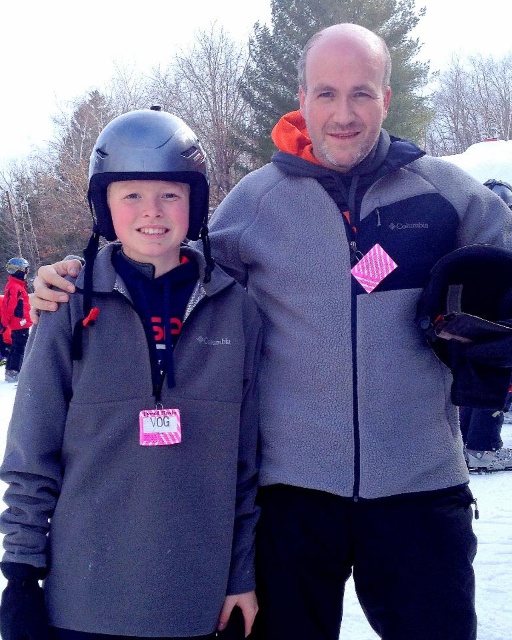
Between point (118, 630) and point (209, 259), which one is positioned behind?

Positioned behind is point (209, 259).

Does matte gray jacket at center have a greater width compared to metallic gray helmet at left?

Yes.

Does point (22, 472) lie in front of point (168, 124)?

Yes, it is in front of point (168, 124).

Where is `matte gray jacket at center`? This screenshot has height=640, width=512. matte gray jacket at center is located at coordinates (136, 417).

Who is positioned more to the left, metallic gray helmet at left or matte black helmet at left?

matte black helmet at left is more to the left.

How much distance is there between metallic gray helmet at left and matte black helmet at left?

They are 48.28 feet apart.

Who is more distant from viewer, (154, 156) or (23, 273)?

Point (23, 273)

I want to click on metallic gray helmet at left, so click(x=146, y=168).

Between matte gray jacket at center and matte black helmet at left, which one has more height?

matte gray jacket at center

Does matte gray jacket at center have a lesser height compared to matte black helmet at left?

Incorrect, matte gray jacket at center's height does not fall short of matte black helmet at left's.

Between point (84, 529) and point (26, 273), which one is positioned in front?

Point (84, 529) is in front.

Identify the location of matte gray jacket at center. The image size is (512, 640). (136, 417).